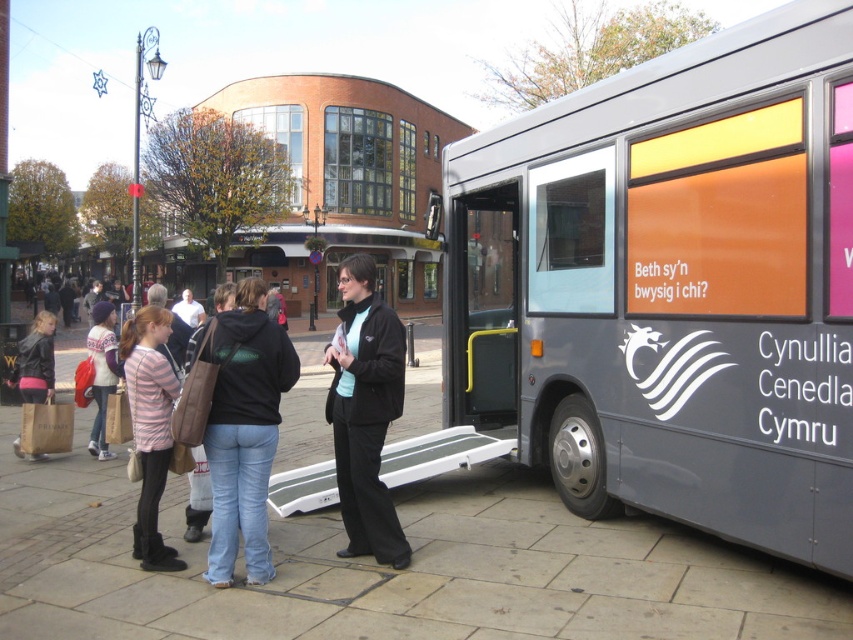
Question: Which object is the farthest from the black matte jacket at center?

Choices:
 (A) denim jeans at center
 (B) striped sweater at center
 (C) silver metallic bus at right
 (D) matte black jacket at lower left

Answer: (D)

Question: Which object is the closest to the striped sweater at center?

Choices:
 (A) matte black jacket at lower left
 (B) denim jeans at center
 (C) silver metallic bus at right
 (D) striped cotton shirt at center

Answer: (A)

Question: Does silver metallic bus at right have a lesser width compared to striped cotton shirt at center?

Choices:
 (A) no
 (B) yes

Answer: (A)

Question: Does striped cotton shirt at center appear under matte black jacket at lower left?

Choices:
 (A) yes
 (B) no

Answer: (A)

Question: Can you confirm if black matte jacket at center is bigger than striped sweater at center?

Choices:
 (A) no
 (B) yes

Answer: (A)

Question: Which of the following is the closest to the observer?

Choices:
 (A) (750, 488)
 (B) (366, 554)

Answer: (A)